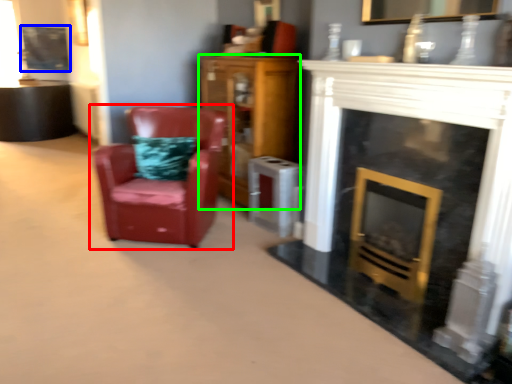
Question: Which object is positioned closest to chair (highlighted by a red box)? Select from picture frame (highlighted by a blue box) and cabinetry (highlighted by a green box).

Choices:
 (A) picture frame
 (B) cabinetry

Answer: (B)